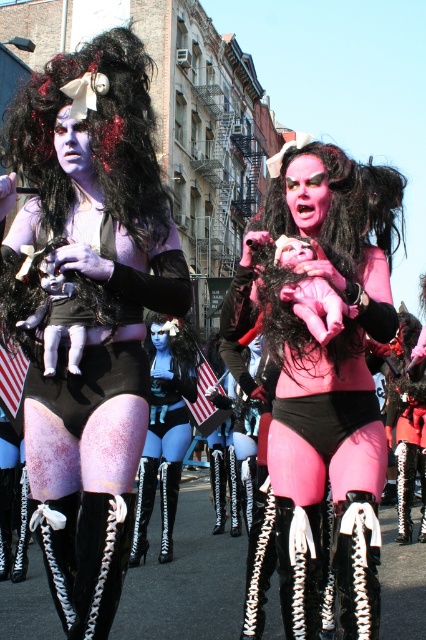
Which of these two, matte black doll at center or pink matte/black leather doll at center, stands taller?

Standing taller between the two is matte black doll at center.

Is the position of matte black doll at center less distant than that of pink matte/black leather doll at center?

No, matte black doll at center is behind pink matte/black leather doll at center.

Which is in front, point (129, 442) or point (334, 195)?

Positioned in front is point (129, 442).

What are the coordinates of `matte black doll at center` in the screenshot? It's located at (88, 308).

Which of these two, purple matte wig at upper left or pink matte wig at center, stands shorter?

Standing shorter between the two is pink matte wig at center.

Describe the element at coordinates (94, 136) in the screenshot. I see `purple matte wig at upper left` at that location.

Find the location of a particular element. purple matte wig at upper left is located at coordinates (94, 136).

Between point (86, 312) and point (340, 198), which one is positioned behind?

The point (340, 198) is more distant.

Is matte black doll at center shorter than pink matte wig at center?

In fact, matte black doll at center may be taller than pink matte wig at center.

The height and width of the screenshot is (640, 426). Describe the element at coordinates (88, 308) in the screenshot. I see `matte black doll at center` at that location.

This screenshot has width=426, height=640. What are the coordinates of `matte black doll at center` in the screenshot? It's located at (88, 308).